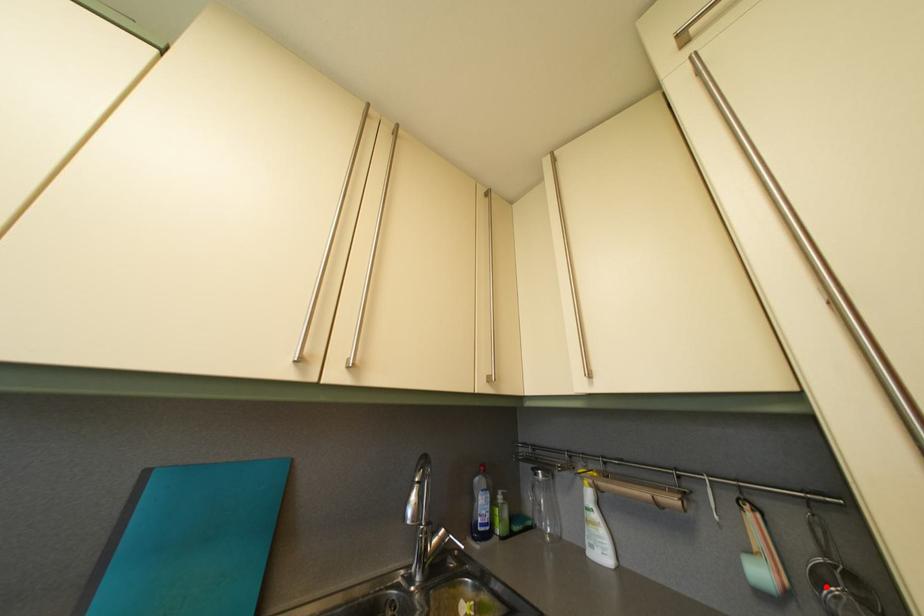
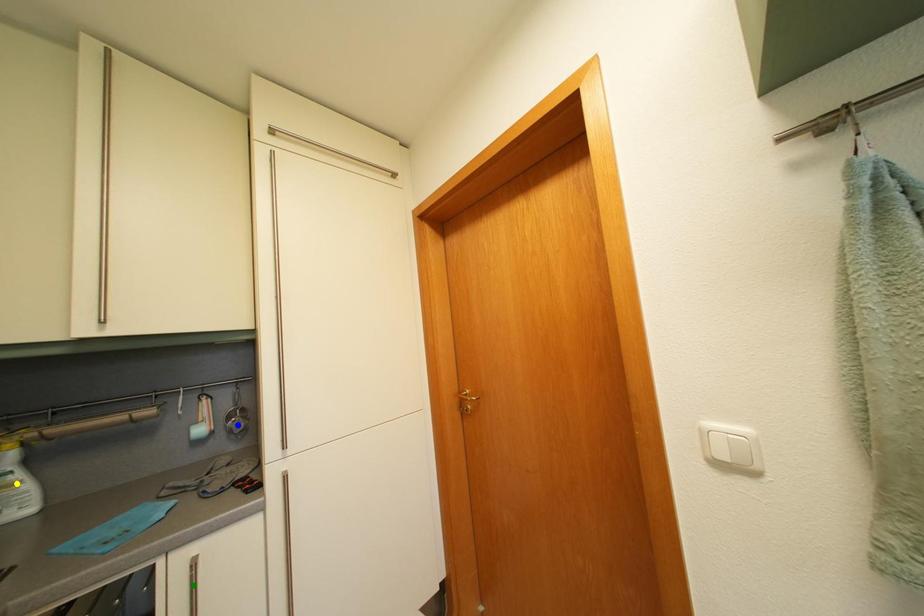
Question: I am providing you with two images of the same scene from different viewpoints. A red point is marked on the first image. You are given multiple points on the second image. Which mark in image 2 goes with the point in image 1?

Choices:
 (A) green point
 (B) blue point
 (C) yellow point

Answer: (B)